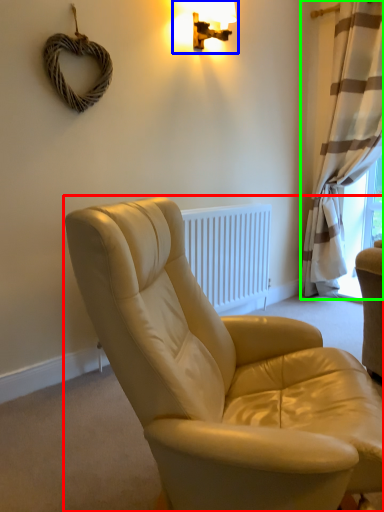
Question: Estimate the real-world distances between objects in this image. Which object is farther from studio couch (highlighted by a red box), lamp (highlighted by a blue box) or curtain (highlighted by a green box)?

Choices:
 (A) lamp
 (B) curtain

Answer: (B)